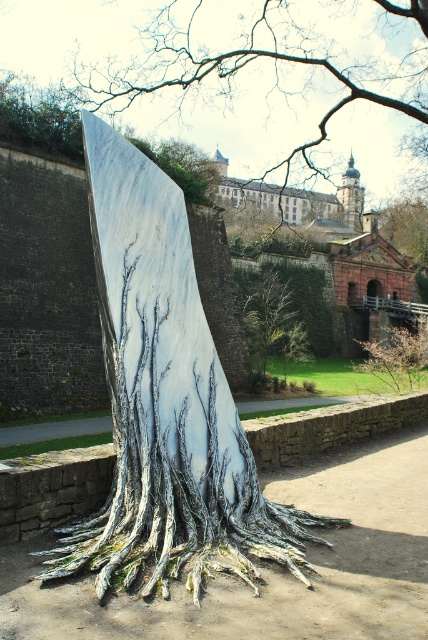
Question: Which point is closer to the camera taking this photo?

Choices:
 (A) (377, 36)
 (B) (422, 369)
 (C) (264, 291)
 (D) (121, 177)

Answer: (D)

Question: Can you confirm if white marble tree at center is thinner than smooth bark tree at center?

Choices:
 (A) yes
 (B) no

Answer: (B)

Question: Can you confirm if white marble tree trunk at center is positioned above white marble tree at center?

Choices:
 (A) yes
 (B) no

Answer: (B)

Question: From the image, what is the correct spatial relationship of white marble tree trunk at center in relation to green leafy tree at center?

Choices:
 (A) right
 (B) left

Answer: (B)

Question: Which point appears farthest from the camera in this image?

Choices:
 (A) (190, 16)
 (B) (267, 323)
 (C) (151, 472)

Answer: (A)

Question: Which point appears farthest from the camera in this image?

Choices:
 (A) (318, 8)
 (B) (377, 355)
 (C) (262, 336)
 (D) (234, 467)

Answer: (A)